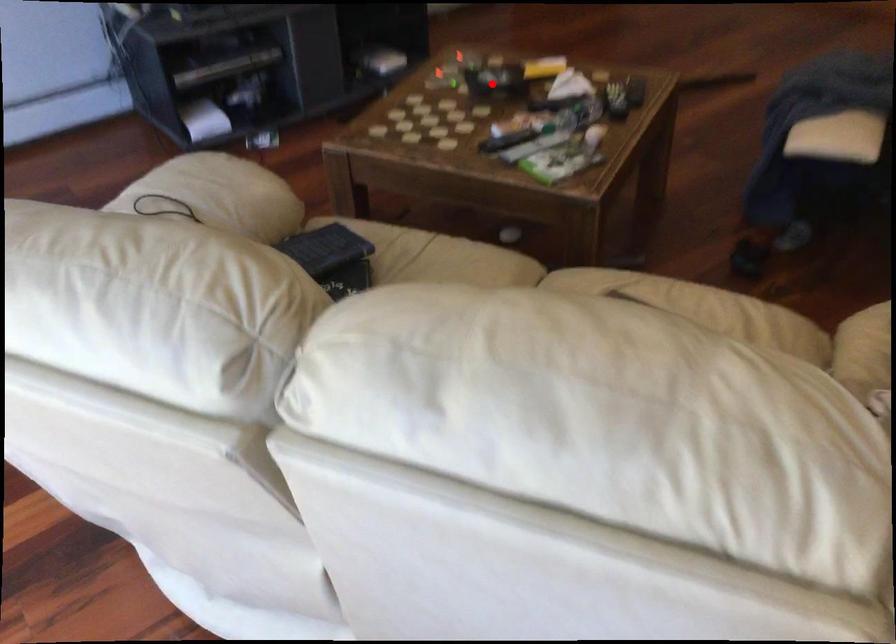
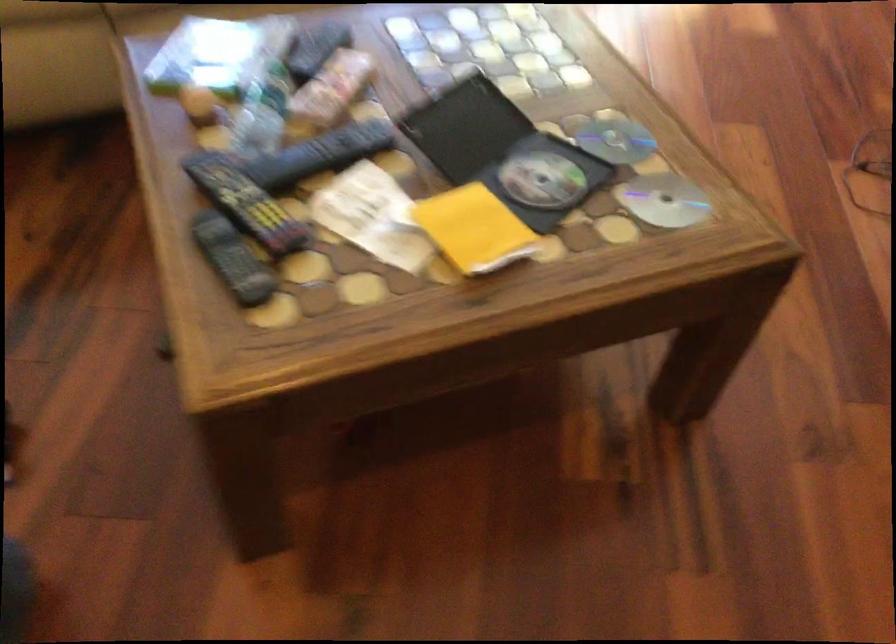
Locate, in the second image, the point that corresponds to the highlighted location in the first image.

(503, 152)